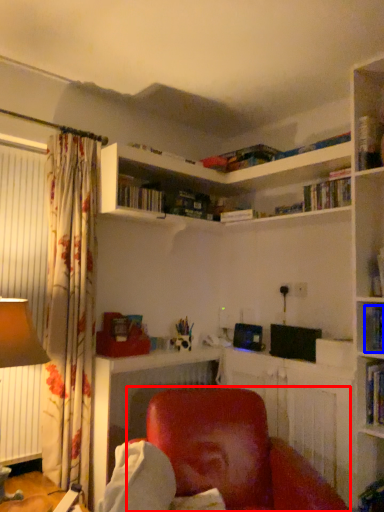
Question: Which point is closer to the camera, chair (highlighted by a red box) or book (highlighted by a blue box)?

Choices:
 (A) chair
 (B) book

Answer: (A)